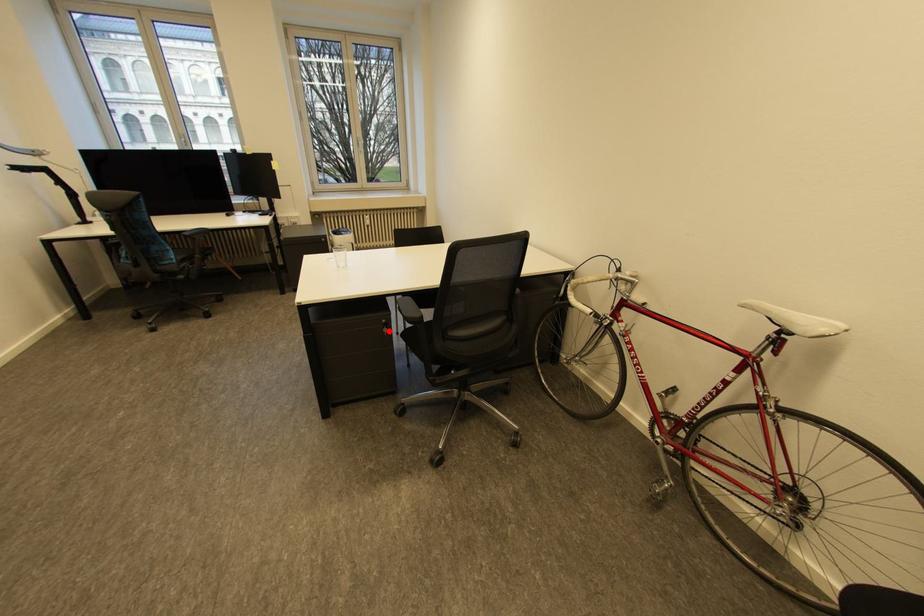
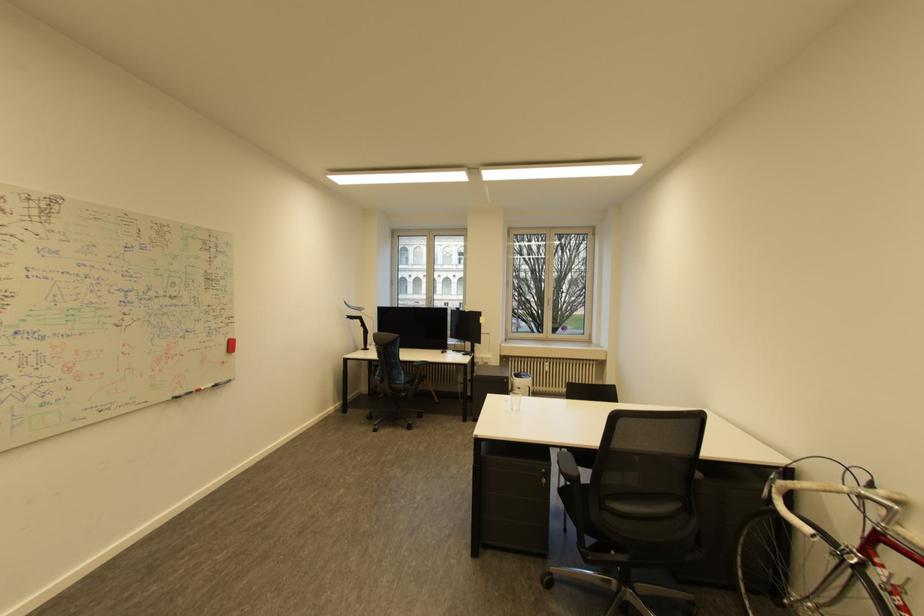
Where in the second image is the point corresponding to the highlighted location from the first image?

(548, 480)